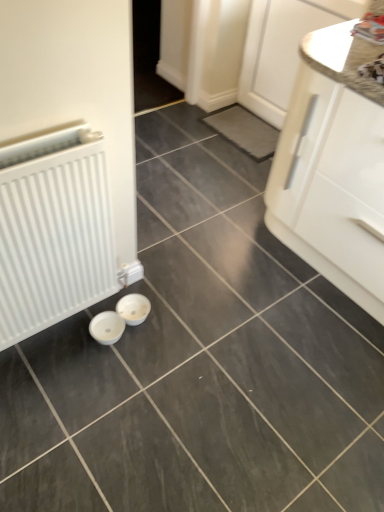
You are a GUI agent. You are given a task and a screenshot of the screen. Output one action in this format:
    pyautogui.click(x=<x>, y=<y>)
    Task: Click on the free space that is to the left of white glossy cabinet at upper right, which appears as the first cabinetry when viewed from the top
    This screenshot has height=512, width=384.
    Given the screenshot: What is the action you would take?
    pyautogui.click(x=200, y=131)